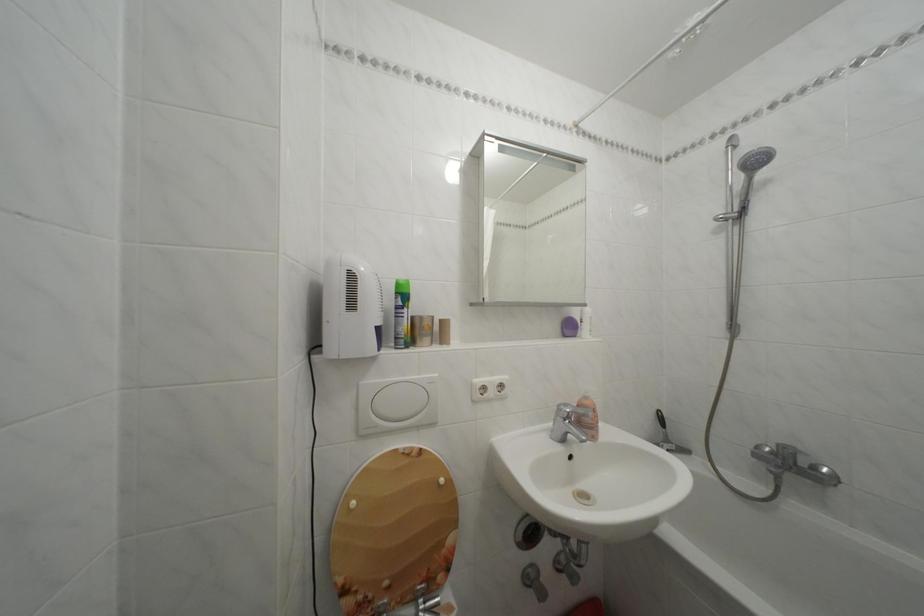
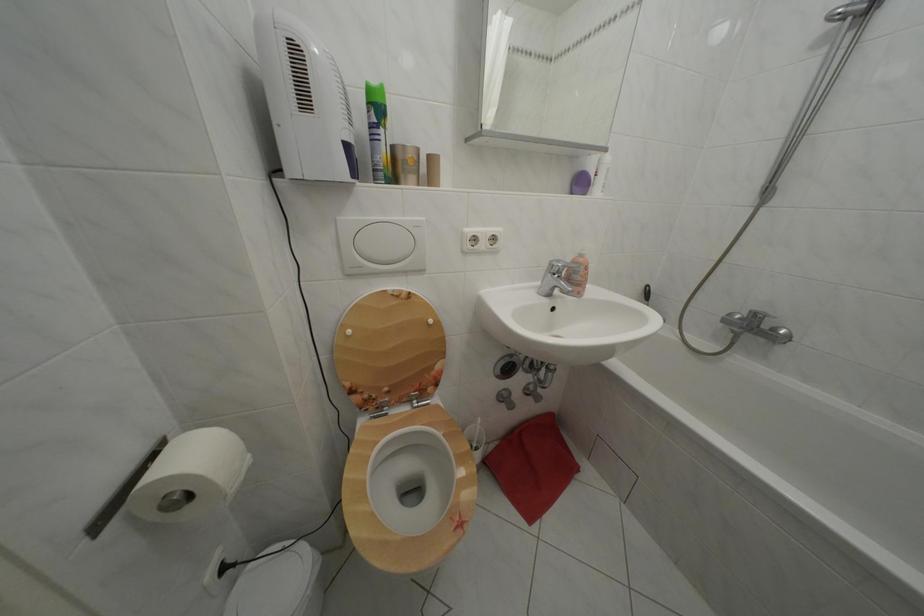
Question: The first image is from the beginning of the video and the second image is from the end. How did the camera likely rotate when shooting the video?

Choices:
 (A) Left
 (B) Right
 (C) Up
 (D) Down

Answer: (D)